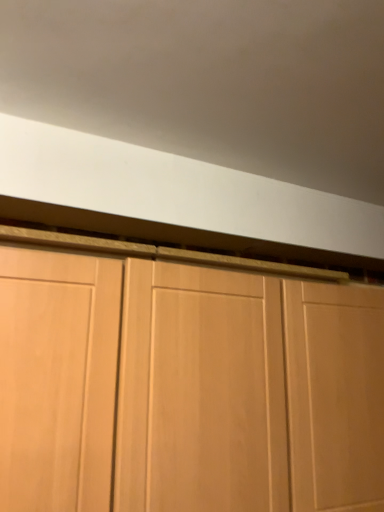
What do you see at coordinates (183, 384) in the screenshot? The width and height of the screenshot is (384, 512). I see `light wood cupboard at center` at bounding box center [183, 384].

Locate an element on the screen. light wood cupboard at center is located at coordinates (183, 384).

Find the location of a particular element. Image resolution: width=384 pixels, height=512 pixels. light wood cupboard at center is located at coordinates (183, 384).